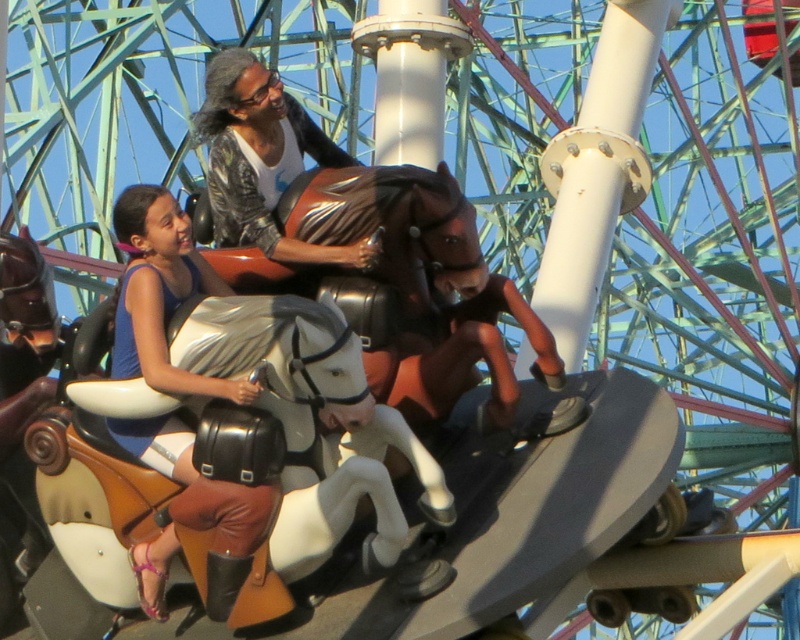
Does matte black vest at center come behind matte black jacket at upper center?

No, matte black vest at center is closer to the viewer.

Can you confirm if matte black vest at center is positioned above matte black jacket at upper center?

No, matte black vest at center is not above matte black jacket at upper center.

This screenshot has height=640, width=800. I want to click on matte black vest at center, so click(x=162, y=294).